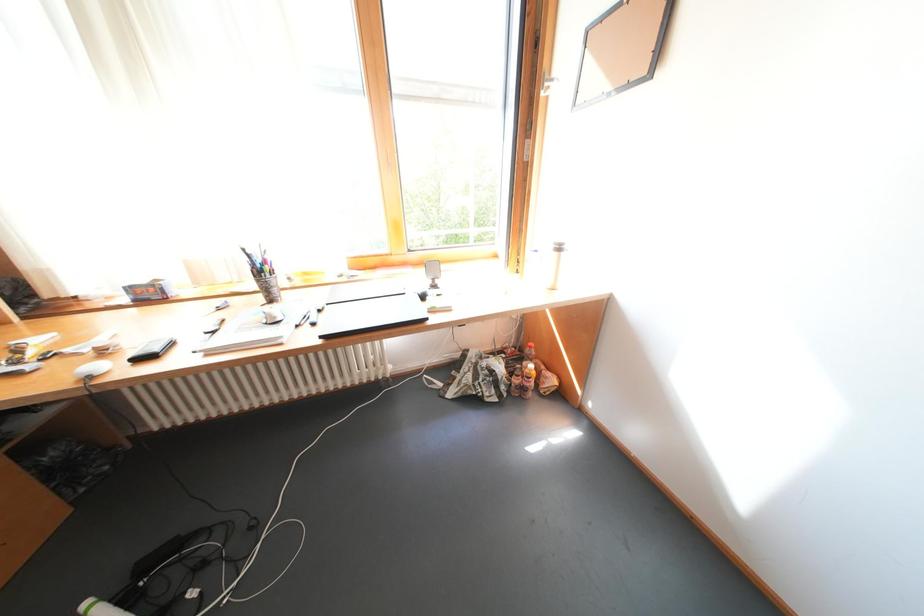
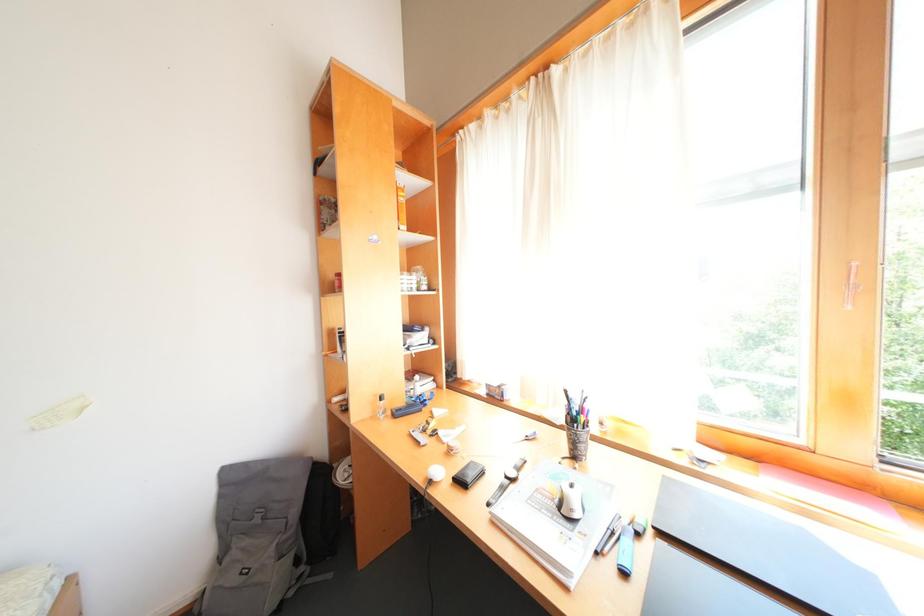
Question: The first image is from the beginning of the video and the second image is from the end. How did the camera likely rotate when shooting the video?

Choices:
 (A) Left
 (B) Right
 (C) Up
 (D) Down

Answer: (A)